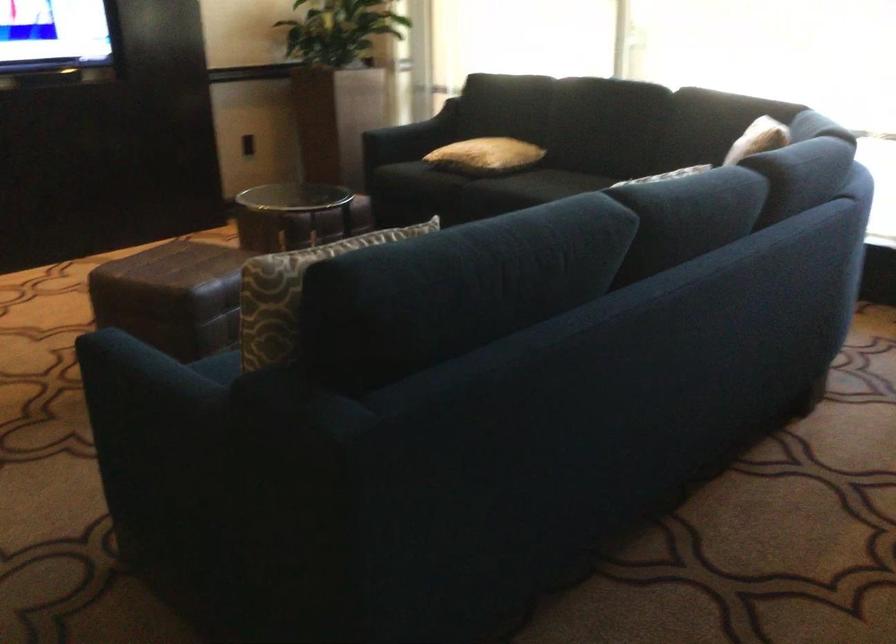
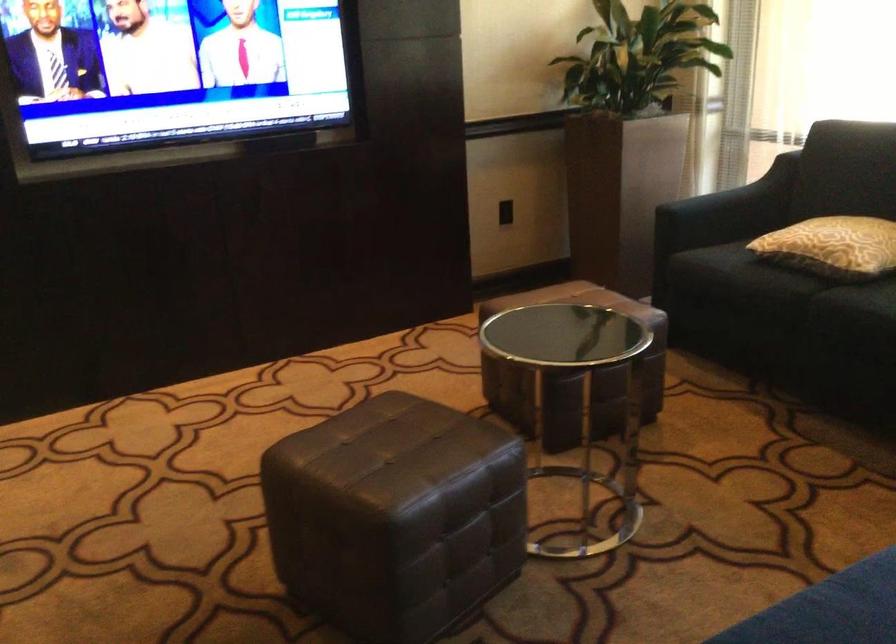
Find the pixel in the second image that matches (436,183) in the first image.

(767, 283)